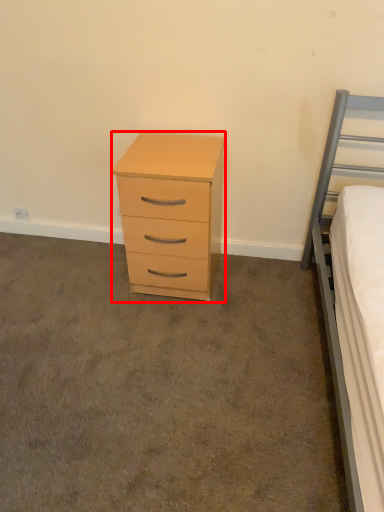
Question: In this image, where is chest of drawers (annotated by the red box) located relative to plain?

Choices:
 (A) right
 (B) left

Answer: (A)